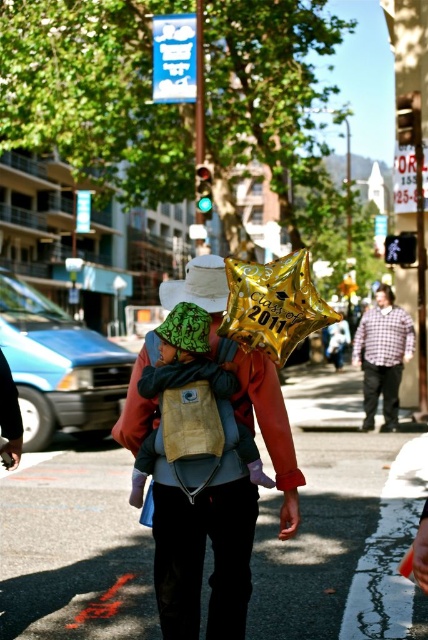
Between plaid shirt at center and matte plaid shirt at center, which one appears on the left side from the viewer's perspective?

Positioned to the left is plaid shirt at center.

Find the location of a particular element. Image resolution: width=428 pixels, height=640 pixels. plaid shirt at center is located at coordinates (383, 356).

Between point (368, 420) and point (377, 294), which one is positioned in front?

Point (368, 420) is in front.

The width and height of the screenshot is (428, 640). I want to click on plaid shirt at center, so click(x=383, y=356).

Between gold metallic balloon at upper center and green fabric baby at center, which one appears on the right side from the viewer's perspective?

gold metallic balloon at upper center

What do you see at coordinates (205, 452) in the screenshot? I see `gold metallic balloon at upper center` at bounding box center [205, 452].

Is point (267, 401) less distant than point (181, 396)?

No.

I want to click on gold metallic balloon at upper center, so click(205, 452).

The width and height of the screenshot is (428, 640). Describe the element at coordinates (273, 305) in the screenshot. I see `gold metallic balloon at center` at that location.

Measure the distance from gold metallic balloon at center to plaid shirt at center.

8.67 meters

Between point (261, 305) and point (365, 394), which one is positioned in front?

Point (261, 305)

The height and width of the screenshot is (640, 428). In order to click on gold metallic balloon at center in this screenshot , I will do `click(273, 305)`.